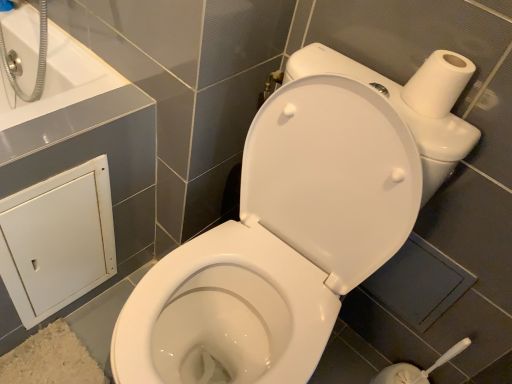
Question: Is white matte cabinet at lower left facing away from white glossy toilet at center?

Choices:
 (A) yes
 (B) no

Answer: (B)

Question: Does white matte cabinet at lower left appear on the right side of white glossy toilet at center?

Choices:
 (A) no
 (B) yes

Answer: (A)

Question: Does white matte cabinet at lower left have a greater width compared to white glossy toilet at center?

Choices:
 (A) no
 (B) yes

Answer: (A)

Question: Can you confirm if white matte cabinet at lower left is positioned to the left of white glossy toilet at center?

Choices:
 (A) no
 (B) yes

Answer: (B)

Question: Are white matte cabinet at lower left and white glossy toilet at center located far from each other?

Choices:
 (A) yes
 (B) no

Answer: (B)

Question: Does white matte cabinet at lower left come behind white glossy toilet at center?

Choices:
 (A) yes
 (B) no

Answer: (A)

Question: From the image's perspective, does white matte toilet paper at upper right appear lower than white glossy bathtub at upper left?

Choices:
 (A) no
 (B) yes

Answer: (B)

Question: Considering the relative sizes of white matte toilet paper at upper right and white glossy bathtub at upper left in the image provided, is white matte toilet paper at upper right taller than white glossy bathtub at upper left?

Choices:
 (A) yes
 (B) no

Answer: (B)

Question: Is white glossy bathtub at upper left a part of white matte toilet paper at upper right?

Choices:
 (A) no
 (B) yes

Answer: (A)

Question: Is white matte toilet paper at upper right far from white glossy bathtub at upper left?

Choices:
 (A) no
 (B) yes

Answer: (A)

Question: From the image's perspective, would you say white matte toilet paper at upper right is positioned over white glossy bathtub at upper left?

Choices:
 (A) yes
 (B) no

Answer: (B)

Question: Is white matte toilet paper at upper right looking in the opposite direction of white glossy bathtub at upper left?

Choices:
 (A) yes
 (B) no

Answer: (B)

Question: Can you confirm if white matte cabinet at lower left is wider than white glossy bathtub at upper left?

Choices:
 (A) no
 (B) yes

Answer: (A)